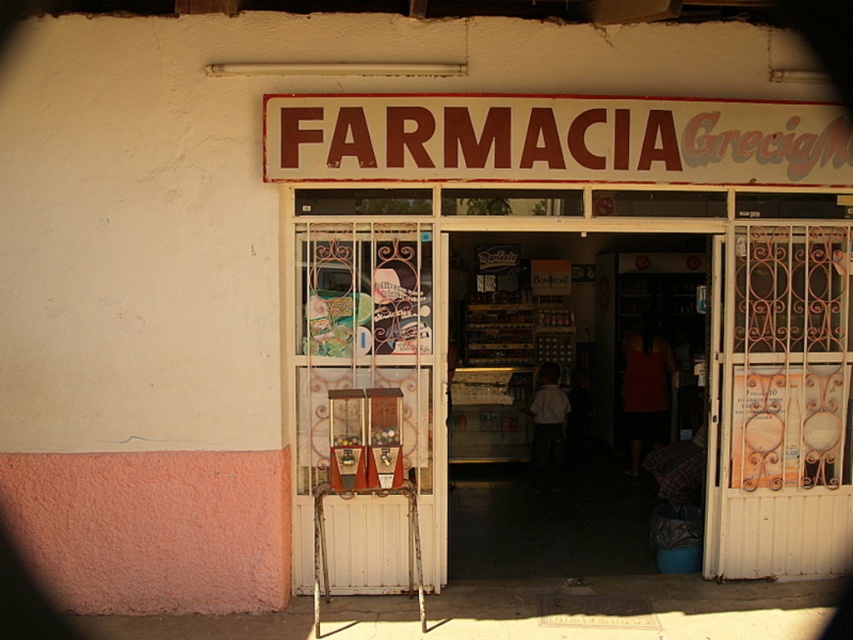
You are standing outside the pharmacy entrance and need to reach the door. The white painted metal gate at right and the brown painted signboard at center are in your way. Which object is taller and might block your view of the entrance?

The white painted metal gate at right is taller than the brown painted signboard at center, so it might block your view of the entrance more than the brown painted signboard at center.

You are standing at the entrance of Farmacia Grecia and want to open the white painted metal gate at right. Based on its position coordinates, can you estimate where exactly the gate is located relative to the entrance?

The white painted metal gate at right is located at coordinates point (779, 401), which means it is positioned slightly to the right and near the bottom of the entrance area.